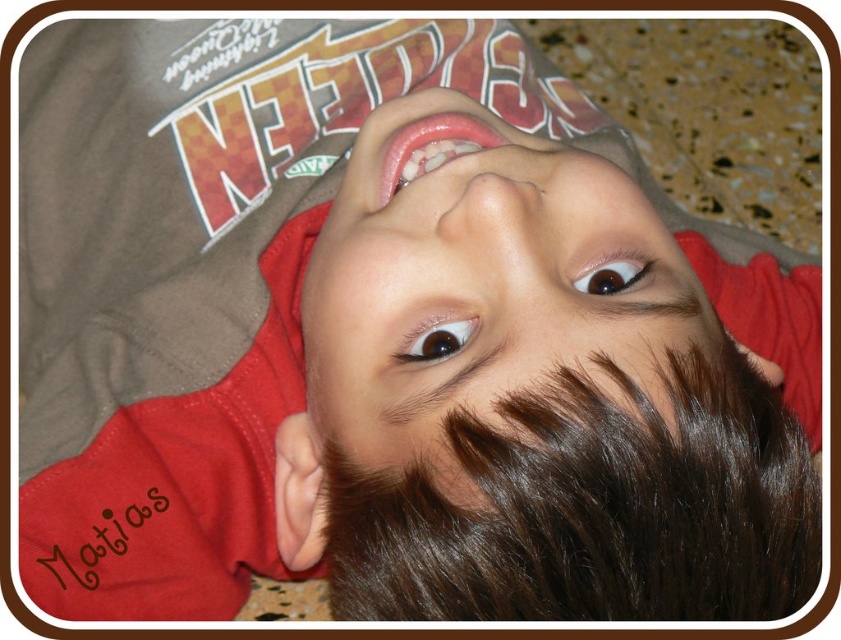
Question: Which object is farther from the camera taking this photo?

Choices:
 (A) smooth skin face at center
 (B) brown shiny eye at upper center

Answer: (B)

Question: Does smooth skin face at center lie behind brown shiny eye at upper center?

Choices:
 (A) yes
 (B) no

Answer: (B)

Question: Which object is farther from the camera taking this photo?

Choices:
 (A) brown shiny eye at upper center
 (B) smooth skin face at center

Answer: (A)

Question: Which object is the closest to the brown glossy eye at center?

Choices:
 (A) brown shiny eye at upper center
 (B) smooth skin face at center

Answer: (B)

Question: Can you confirm if brown glossy eye at center is thinner than brown shiny eye at upper center?

Choices:
 (A) no
 (B) yes

Answer: (B)

Question: Does smooth skin face at center come behind brown shiny eye at upper center?

Choices:
 (A) yes
 (B) no

Answer: (B)